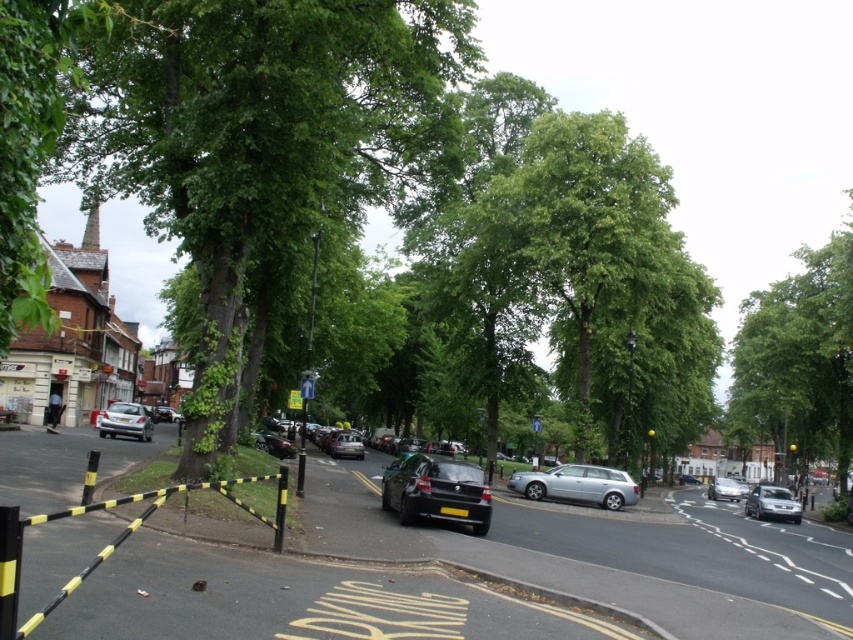
Between point (712, 477) and point (682, 481), which one is positioned behind?

The point (712, 477) is behind.

Between silver metallic hatchback at center-right and silver metallic hatchback at center, which one has less height?

With less height is silver metallic hatchback at center-right.

Is point (728, 477) behind point (697, 481)?

No, (728, 477) is closer to viewer.

Where is `silver metallic hatchback at center-right`? The image size is (853, 640). silver metallic hatchback at center-right is located at coordinates (723, 490).

Can you confirm if shiny black car at center is bigger than silver metallic hatchback at left?

Actually, shiny black car at center might be smaller than silver metallic hatchback at left.

Can you confirm if shiny black car at center is wider than silver metallic hatchback at left?

In fact, shiny black car at center might be narrower than silver metallic hatchback at left.

Which is behind, point (265, 432) or point (163, 419)?

The point (163, 419) is more distant.

What are the coordinates of `shiny black car at center` in the screenshot? It's located at (274, 444).

Is point (751, 509) more distant than point (677, 476)?

That is False.

Which of these two, satin silver sedan at center or silver metallic hatchback at center, stands shorter?

Standing shorter between the two is satin silver sedan at center.

Which is in front, point (772, 502) or point (686, 476)?

Point (772, 502)

Where is `satin silver sedan at center`? Image resolution: width=853 pixels, height=640 pixels. satin silver sedan at center is located at coordinates [x=772, y=502].